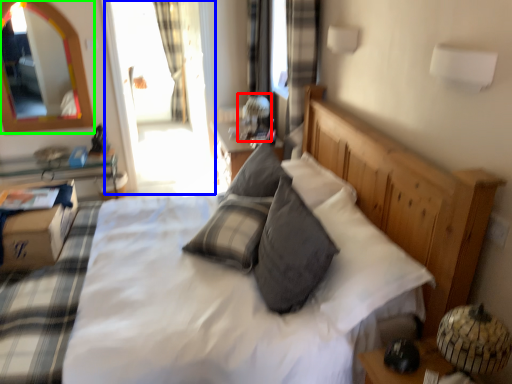
Question: Considering the real-world distances, which object is farthest from table lamp (highlighted by a red box)? glass door (highlighted by a blue box) or mirror (highlighted by a green box)?

Choices:
 (A) glass door
 (B) mirror

Answer: (B)